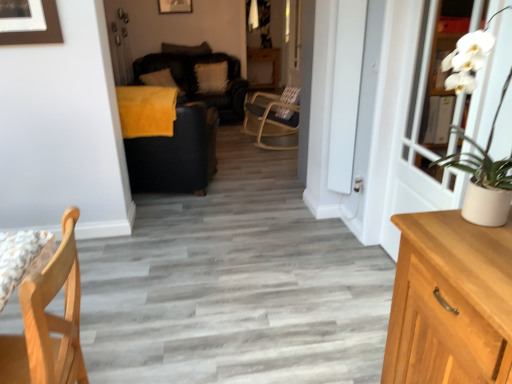
Question: From a real-world perspective, is light wood chair at lower left physically below white glossy screen door at right?

Choices:
 (A) yes
 (B) no

Answer: (A)

Question: From the image's perspective, is light wood chair at lower left under white glossy screen door at right?

Choices:
 (A) no
 (B) yes

Answer: (B)

Question: Is light wood chair at lower left smaller than white glossy screen door at right?

Choices:
 (A) no
 (B) yes

Answer: (A)

Question: Is light wood chair at lower left not within white glossy screen door at right?

Choices:
 (A) no
 (B) yes

Answer: (B)

Question: Can you confirm if light wood chair at lower left is positioned to the left of white glossy screen door at right?

Choices:
 (A) no
 (B) yes

Answer: (B)

Question: Is light wood chair at lower left shorter than white glossy screen door at right?

Choices:
 (A) yes
 (B) no

Answer: (A)

Question: Is white wooden door at right facing towards dark gray fabric pillow at upper center, which appears as the second pillow when viewed from the right?

Choices:
 (A) no
 (B) yes

Answer: (A)

Question: Is white wooden door at right turned away from dark gray fabric pillow at upper center, the second pillow in the left-to-right sequence?

Choices:
 (A) no
 (B) yes

Answer: (A)

Question: Are white wooden door at right and dark gray fabric pillow at upper center, which appears as the second pillow when viewed from the right, beside each other?

Choices:
 (A) no
 (B) yes

Answer: (A)

Question: From a real-world perspective, is white wooden door at right under dark gray fabric pillow at upper center, which appears as the second pillow when viewed from the right?

Choices:
 (A) no
 (B) yes

Answer: (B)

Question: Can you confirm if white wooden door at right is positioned to the right of dark gray fabric pillow at upper center, the second pillow in the left-to-right sequence?

Choices:
 (A) no
 (B) yes

Answer: (B)

Question: Can you confirm if white wooden door at right is shorter than dark gray fabric pillow at upper center, which appears as the second pillow when viewed from the right?

Choices:
 (A) yes
 (B) no

Answer: (B)

Question: Considering the relative positions of wooden picture frame at upper center and dark gray fabric pillow at upper center, which appears as the second pillow when viewed from the right, in the image provided, is wooden picture frame at upper center in front of dark gray fabric pillow at upper center, which appears as the second pillow when viewed from the right,?

Choices:
 (A) yes
 (B) no

Answer: (A)